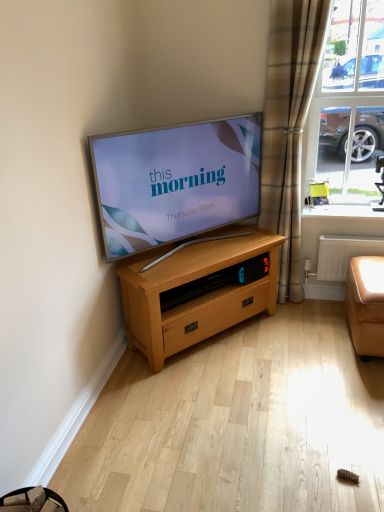
Question: Looking at the image, does white glossy window sill at upper right seem bigger or smaller compared to tan leather armchair at right?

Choices:
 (A) big
 (B) small

Answer: (A)

Question: Visually, is white glossy window sill at upper right positioned to the left or to the right of tan leather armchair at right?

Choices:
 (A) left
 (B) right

Answer: (B)

Question: Estimate the real-world distances between objects in this image. Which object is closer to the white plastic radiator at lower right?

Choices:
 (A) leather-like orange couch at lower right
 (B) matte silver tv at center
 (C) clear glass window at upper right
 (D) tan leather armchair at right
 (E) white glossy window sill at upper right

Answer: (E)

Question: Considering the real-world distances, which object is closest to the white plastic radiator at lower right?

Choices:
 (A) leather-like orange couch at lower right
 (B) clear glass window at upper right
 (C) tan leather armchair at right
 (D) plaid fabric curtain at right
 (E) white glossy window sill at upper right

Answer: (E)